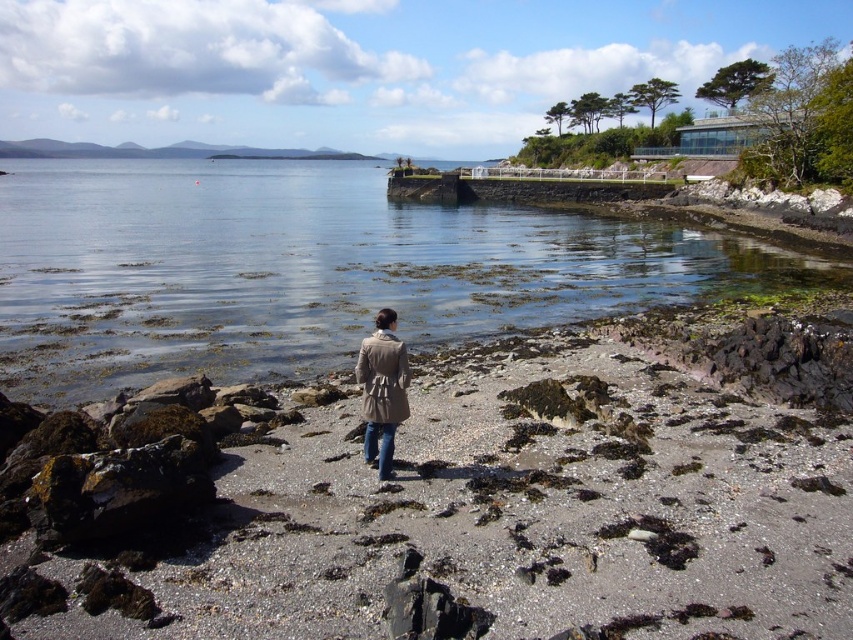
Question: Does smooth sand beach at center have a larger size compared to tan textured trench coat at center?

Choices:
 (A) no
 (B) yes

Answer: (B)

Question: Which point is farther from the camera taking this photo?

Choices:
 (A) (408, 371)
 (B) (653, 612)
 (C) (370, 449)
 (D) (47, 176)

Answer: (D)

Question: Which object is positioned farthest from the smooth sand beach at center?

Choices:
 (A) clear water at center
 (B) tan textured trench coat at center
 (C) blue denim jeans at center

Answer: (A)

Question: Where is clear water at center located in relation to tan textured trench coat at center in the image?

Choices:
 (A) left
 (B) right

Answer: (A)

Question: Does clear water at center lie behind blue denim jeans at center?

Choices:
 (A) no
 (B) yes

Answer: (B)

Question: Which object appears farthest from the camera in this image?

Choices:
 (A) clear water at center
 (B) tan textured trench coat at center

Answer: (A)